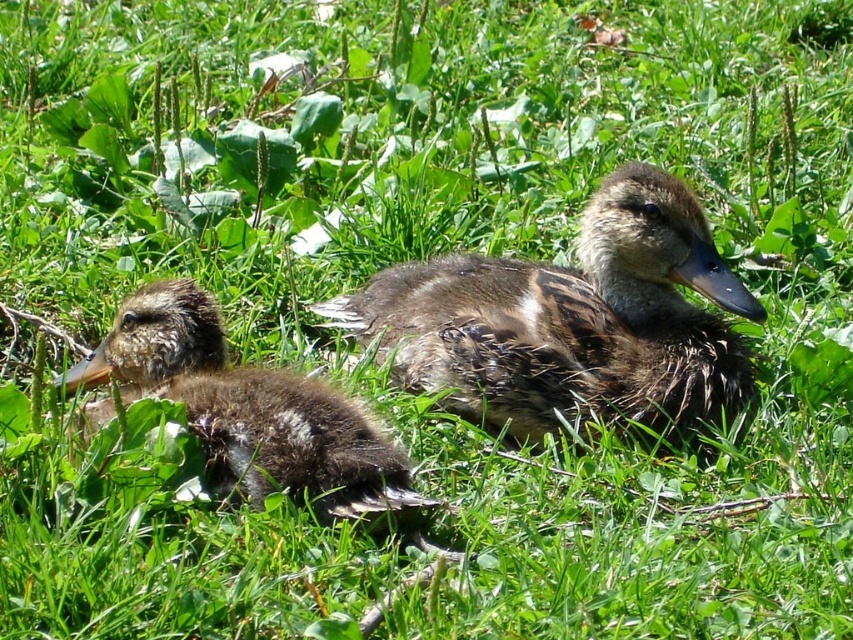
You are observing two ducklings on a grassy area. You see a brown fuzzy duckling at center and another object. Which object corresponds to the coordinates point (x=572, y=321)?

The brown fuzzy duckling at center corresponds to the coordinates point (x=572, y=321).

You are a photographer trying to capture the two ducklings in the scene. You notice that one of the points, point (576, 272), is closer to you than the other point (322, 385). If you want to focus on the duckling that is closer to you, which point should you aim your camera at?

Point (576, 272) is closer to you, so you should aim your camera at point (576, 272) to focus on the duckling that is closer.

From the picture: You are a birdwatcher observing two ducklings in a grassy area. You notice a brown fuzzy duckling at center and a brown fuzzy duckling at left. Which duckling is closer to you?

The brown fuzzy duckling at center is closer to you because the brown fuzzy duckling at left is behind it.